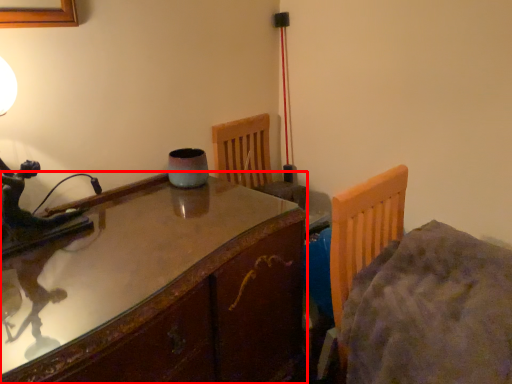
Question: From the image, what is the correct spatial relationship of table (annotated by the red box) in relation to bed?

Choices:
 (A) left
 (B) right

Answer: (A)